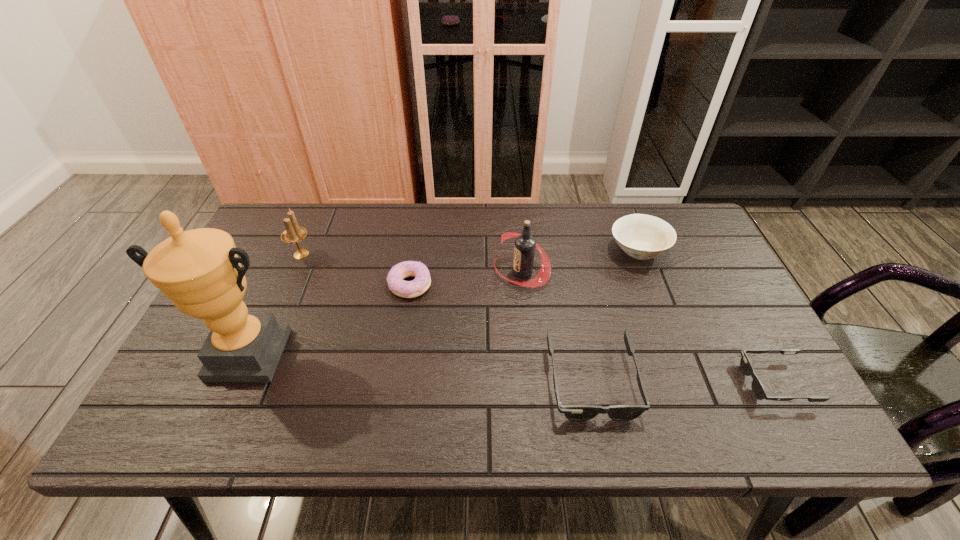
Identify the location of object that is at the near right corner. (758, 389).

Locate an element on the screen. This screenshot has height=540, width=960. vacant space at the far edge of the desktop is located at coordinates (551, 217).

Identify the location of free space at the near edge. (711, 379).

What are the coordinates of `blank space at the left edge of the desktop` in the screenshot? It's located at (251, 275).

This screenshot has width=960, height=540. I want to click on blank space at the right edge of the desktop, so click(710, 274).

Locate an element on the screen. This screenshot has width=960, height=540. vacant space at the far right corner is located at coordinates (683, 226).

Locate an element on the screen. This screenshot has height=540, width=960. vacant area that lies between the award and the left sunglasses is located at coordinates (420, 367).

Where is `vacant area between the root beer and the taller sunglasses`? The width and height of the screenshot is (960, 540). vacant area between the root beer and the taller sunglasses is located at coordinates (557, 326).

The width and height of the screenshot is (960, 540). In order to click on vacant point located between the root beer and the third object from left to right in this screenshot , I will do `click(466, 278)`.

Locate an element on the screen. vacant space that's between the tallest object and the candle holder is located at coordinates (275, 304).